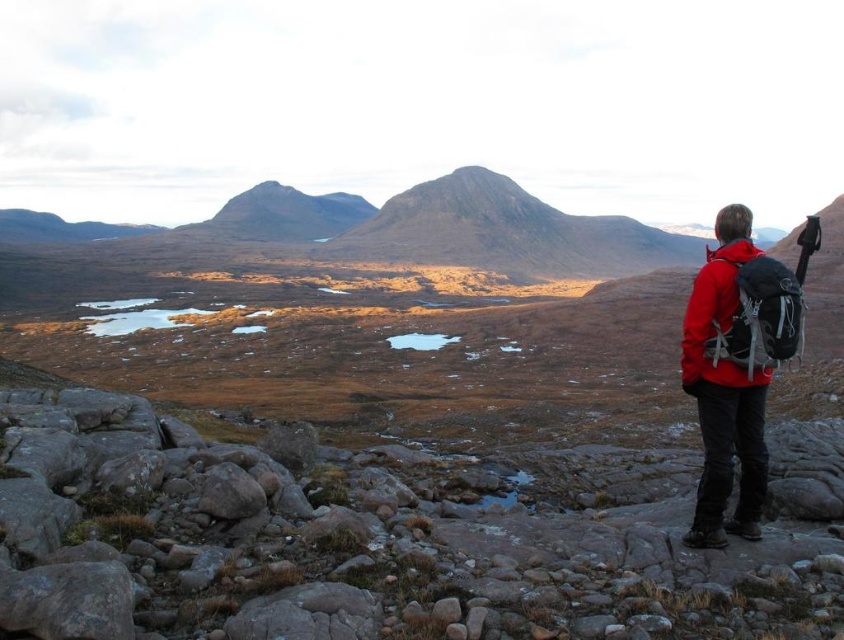
Question: Is red matte jacket at right positioned before matte red jacket at right?

Choices:
 (A) no
 (B) yes

Answer: (B)

Question: Which of the following is the closest to the observer?

Choices:
 (A) (718, 365)
 (B) (818, 435)
 (C) (755, 358)

Answer: (C)

Question: Can you confirm if gray rock at lower right is thinner than red matte jacket at right?

Choices:
 (A) no
 (B) yes

Answer: (A)

Question: Which object appears closest to the camera in this image?

Choices:
 (A) matte red jacket at right
 (B) gray rock at lower right

Answer: (B)

Question: Can you confirm if gray rock at lower right is positioned to the left of red matte jacket at right?

Choices:
 (A) no
 (B) yes

Answer: (B)

Question: Among these points, which one is farthest from the camera?

Choices:
 (A) (747, 275)
 (B) (734, 244)
 (C) (667, 541)

Answer: (B)